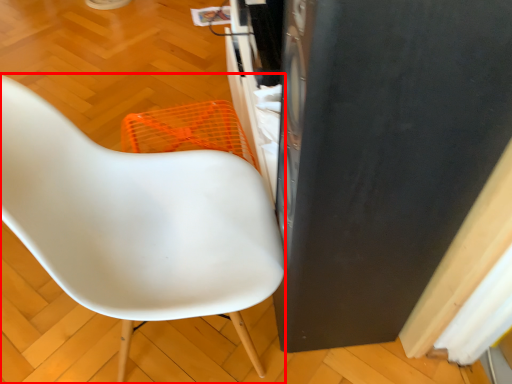
Question: From the image's perspective, what is the correct spatial positioning of chair (annotated by the red box) in reference to appliance?

Choices:
 (A) below
 (B) above

Answer: (A)